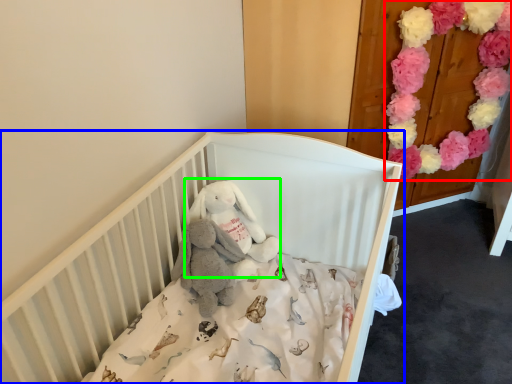
Question: Estimate the real-world distances between objects in this image. Which object is farther from flower (highlighted by a red box), infant bed (highlighted by a blue box) or toy (highlighted by a green box)?

Choices:
 (A) infant bed
 (B) toy

Answer: (B)